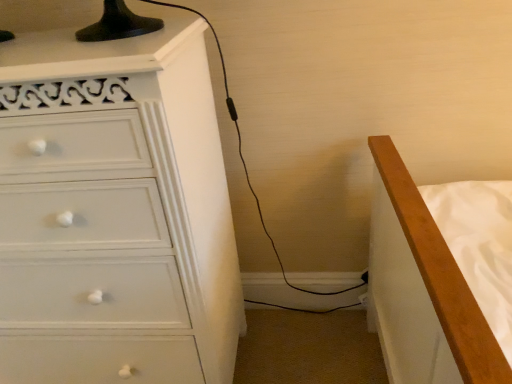
What is the approximate width of white glossy chest of drawers at left?

It is 17.90 inches.

The height and width of the screenshot is (384, 512). What are the coordinates of `white glossy chest of drawers at left` in the screenshot? It's located at (115, 212).

What do you see at coordinates (115, 212) in the screenshot? This screenshot has width=512, height=384. I see `white glossy chest of drawers at left` at bounding box center [115, 212].

Locate an element on the screen. Image resolution: width=512 pixels, height=384 pixels. white glossy chest of drawers at left is located at coordinates (115, 212).